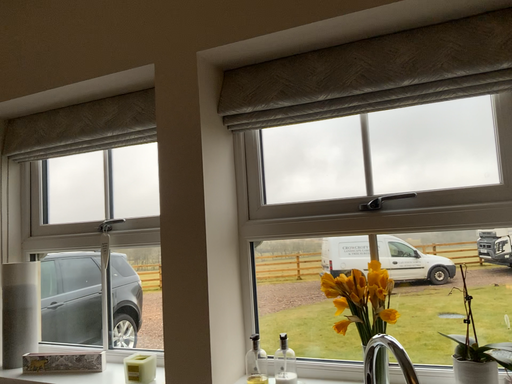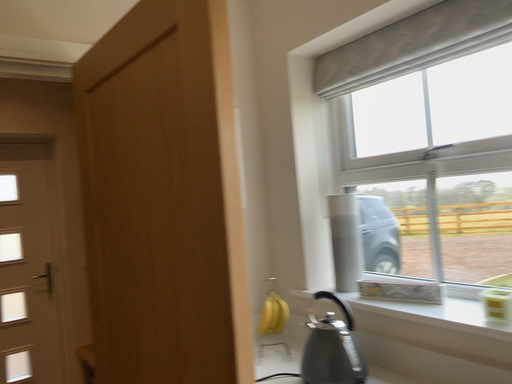
Question: How did the camera likely rotate when shooting the video?

Choices:
 (A) rotated left
 (B) rotated right

Answer: (A)